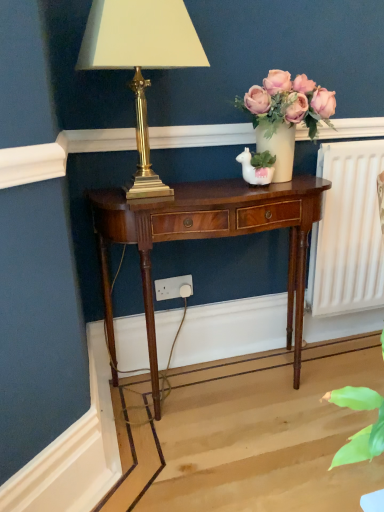
Find the location of `free spot below mahogany wood nightstand at center (from a real-world perspective)`. free spot below mahogany wood nightstand at center (from a real-world perspective) is located at coordinates (211, 382).